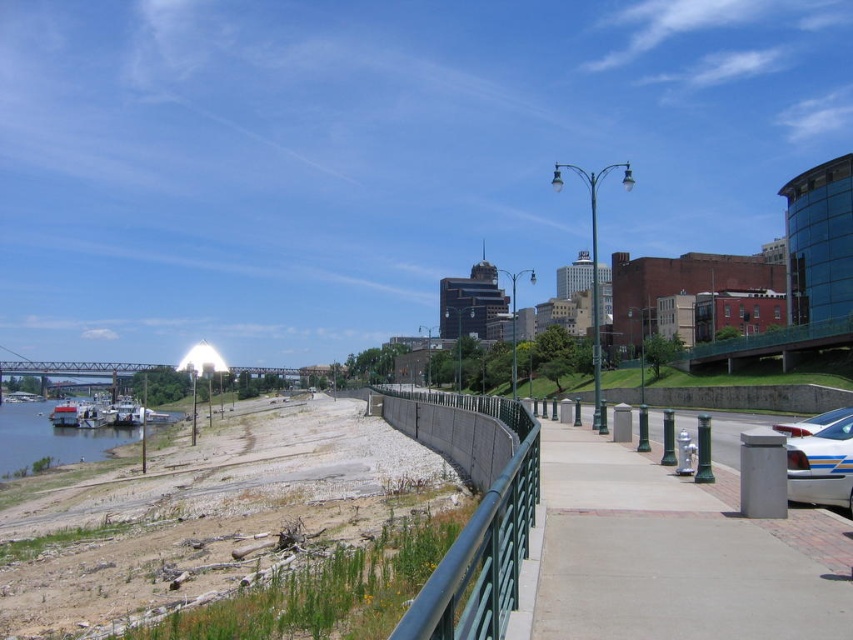
Does gray concrete pavement at center appear over white plastic boat at lower left?

Yes.

Between point (543, 472) and point (88, 426), which one is positioned in front?

Point (543, 472) is more forward.

This screenshot has height=640, width=853. What are the coordinates of `gray concrete pavement at center` in the screenshot? It's located at (x=674, y=554).

Can you confirm if green metal railing at center is positioned above metallic blue car at right?

No.

I want to click on green metal railing at center, so click(474, 509).

This screenshot has height=640, width=853. Identify the location of green metal railing at center. (474, 509).

Is smooth concrete river at lower left positioned in front of white plastic boat at lower left?

Yes, smooth concrete river at lower left is in front of white plastic boat at lower left.

Does smooth concrete river at lower left appear on the left side of white plastic boat at lower left?

Correct, you'll find smooth concrete river at lower left to the left of white plastic boat at lower left.

Measure the distance between point [53,445] and camera.

Point [53,445] is 80.81 meters from camera.

Locate an element on the screen. The height and width of the screenshot is (640, 853). smooth concrete river at lower left is located at coordinates (50, 438).